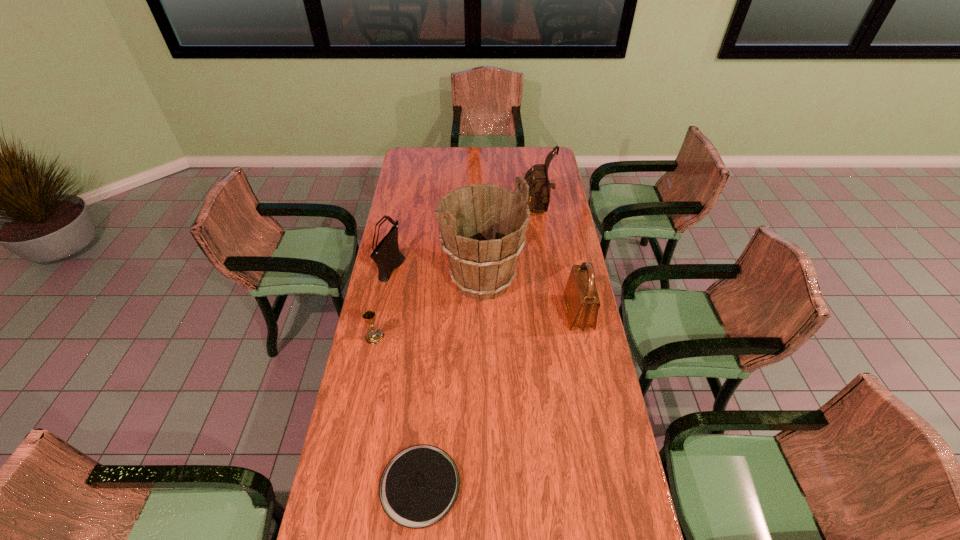
Identify the location of the tallest object. (483, 227).

Identify the location of the farthest object. (537, 178).

Where is `the leftmost shoulder bag`? Image resolution: width=960 pixels, height=540 pixels. the leftmost shoulder bag is located at coordinates (387, 256).

Identify the location of the nearest shoulder bag. (581, 298).

At what (x,y) coordinates should I click in order to perform the action: click on the fifth tallest object. Please return your answer as a coordinate pair (x, y). Image resolution: width=960 pixels, height=540 pixels. Looking at the image, I should click on (374, 336).

This screenshot has height=540, width=960. I want to click on the nearest object, so click(x=419, y=486).

Identify the location of the shortest object. Image resolution: width=960 pixels, height=540 pixels. (419, 486).

Where is `free point located 0.160m on the left of the bucket`? free point located 0.160m on the left of the bucket is located at coordinates (403, 280).

Locate an element on the screen. This screenshot has width=960, height=540. vacant area situated 0.140m on the front-facing side of the farthest object is located at coordinates (492, 211).

Find the location of a particular element. vacant area situated 0.140m on the front-facing side of the farthest object is located at coordinates (492, 211).